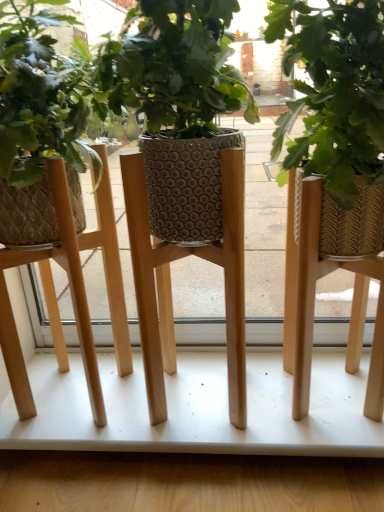
What do you see at coordinates (198, 408) in the screenshot? I see `wooden table at center` at bounding box center [198, 408].

I want to click on wooden table at center, so click(198, 408).

Considering the positions of point (52, 284) and point (367, 198), is point (52, 284) closer or farther from the camera than point (367, 198)?

Point (52, 284) is farther from the camera than point (367, 198).

Would you consider wooden stool at center to be distant from woven straw planter at center?

wooden stool at center is actually quite close to woven straw planter at center.

How far apart are wooden stool at center and woven straw planter at center?

They are 15.34 inches apart.

Considering the sizes of wooden stool at center and woven straw planter at center in the image, is wooden stool at center taller or shorter than woven straw planter at center?

Clearly, wooden stool at center is taller compared to woven straw planter at center.

Considering the relative positions of wooden table at center and wooden stool at center in the image provided, is wooden table at center to the right of wooden stool at center from the viewer's perspective?

Yes.

Is wooden table at center not within wooden stool at center?

Absolutely, wooden table at center is external to wooden stool at center.

From the image's perspective, which object appears higher, wooden table at center or wooden stool at center?

wooden stool at center.

Can you tell me how much wooden table at center and wooden stool at center differ in facing direction?

The angular difference between wooden table at center and wooden stool at center is 1.84 degrees.

Is wooden stool at center facing towards wooden table at center?

No, wooden stool at center is not oriented towards wooden table at center.

Considering the relative sizes of wooden stool at center and wooden table at center in the image provided, is wooden stool at center thinner than wooden table at center?

Indeed, wooden stool at center has a lesser width compared to wooden table at center.

Considering the relative sizes of wooden stool at center and wooden table at center in the image provided, is wooden stool at center shorter than wooden table at center?

No.

Between wooden table at center and woven straw planter at center, which one has more height?

woven straw planter at center is taller.

This screenshot has width=384, height=512. I want to click on table below the woven straw planter at center (from the image's perspective), so click(x=198, y=408).

Is wooden table at center oriented away from woven straw planter at center?

That's not correct — wooden table at center is not looking away from woven straw planter at center.

Can you confirm if wooden table at center is positioned to the left of woven straw planter at center?

Correct, you'll find wooden table at center to the left of woven straw planter at center.

Between point (270, 2) and point (330, 386), which one is positioned in front?

Positioned in front is point (270, 2).

Considering the sizes of woven straw planter at center and wooden table at center in the image, is woven straw planter at center wider or thinner than wooden table at center?

In the image, woven straw planter at center appears to be more narrow than wooden table at center.

From the image's perspective, is woven straw planter at center located above or below wooden table at center?

woven straw planter at center is situated higher than wooden table at center in the image.

Would you say woven straw planter at center is to the left or to the right of wooden table at center in the picture?

woven straw planter at center is to the right of wooden table at center.

Considering the sizes of woven straw planter at center and wooden stool at center in the image, is woven straw planter at center bigger or smaller than wooden stool at center?

In the image, woven straw planter at center appears to be larger than wooden stool at center.

The image size is (384, 512). I want to click on stool behind the woven straw planter at center, so 71,291.

Relative to wooden stool at center, is woven straw planter at center in front or behind?

Visually, woven straw planter at center is located in front of wooden stool at center.

How different are the orientations of woven straw planter at center and wooden stool at center in degrees?

They differ by 6.99e-05 degrees in their facing directions.

Where is `stool that appears above the woven straw planter at center (from the image's perspective)`? The height and width of the screenshot is (512, 384). stool that appears above the woven straw planter at center (from the image's perspective) is located at coordinates (71, 291).

Image resolution: width=384 pixels, height=512 pixels. Identify the location of table that is under the wooden stool at center (from a real-world perspective). (198, 408).

Consider the image. Considering their positions, is woven straw planter at center positioned closer to wooden table at center than wooden stool at center?

wooden stool at center.

Considering their positions, is woven straw planter at center positioned closer to wooden stool at center than wooden table at center?

wooden table at center lies closer to wooden stool at center than the other object.

From the picture: Considering their positions, is wooden table at center positioned further to woven straw planter at center than wooden stool at center?

wooden stool at center is further to woven straw planter at center.

Based on their spatial positions, is wooden stool at center or woven straw planter at center closer to wooden table at center?

wooden stool at center is positioned closer to the anchor wooden table at center.

When comparing their distances from woven straw planter at center, does wooden stool at center or wooden table at center seem further?

wooden stool at center is positioned further to the anchor woven straw planter at center.

From the image, which object appears to be farther from wooden stool at center, wooden table at center or woven straw planter at center?

woven straw planter at center is further to wooden stool at center.

Locate an element on the screen. The width and height of the screenshot is (384, 512). houseplant between wooden stool at center and wooden table at center in the vertical direction is located at coordinates (334, 176).